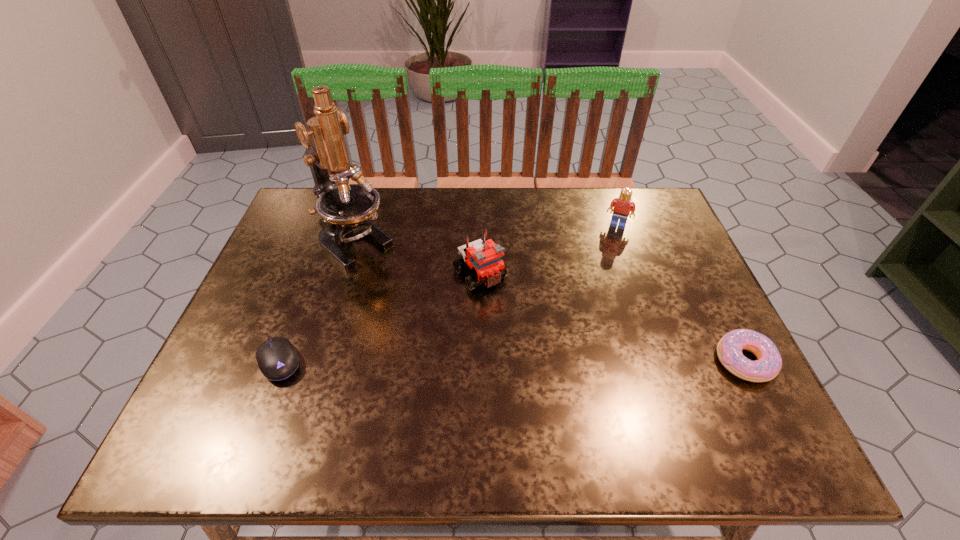
Locate an element on the screen. free location that satisfies the following two spatial constraints: 1. on the back side of the computer mouse; 2. on the left side of the third object from right to left is located at coordinates (313, 274).